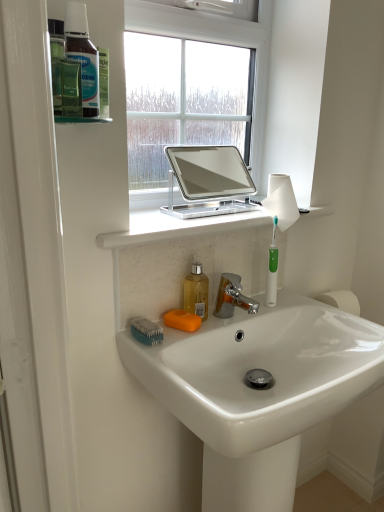
Question: Is white glossy sink at center not inside green plastic toothbrush at right?

Choices:
 (A) yes
 (B) no

Answer: (A)

Question: Is white glossy sink at center bigger than green plastic toothbrush at right?

Choices:
 (A) no
 (B) yes

Answer: (B)

Question: Is the depth of white glossy sink at center less than that of green plastic toothbrush at right?

Choices:
 (A) no
 (B) yes

Answer: (B)

Question: Is white glossy sink at center further to camera compared to green plastic toothbrush at right?

Choices:
 (A) yes
 (B) no

Answer: (B)

Question: Is green plastic toothbrush at right inside white glossy sink at center?

Choices:
 (A) yes
 (B) no

Answer: (B)

Question: Looking at their shapes, would you say green plastic toothbrush at right is wider or thinner than translucent plastic bottles at upper left?

Choices:
 (A) thin
 (B) wide

Answer: (A)

Question: From a real-world perspective, is green plastic toothbrush at right positioned above or below translucent plastic bottles at upper left?

Choices:
 (A) above
 (B) below

Answer: (B)

Question: Is green plastic toothbrush at right in front of or behind translucent plastic bottles at upper left in the image?

Choices:
 (A) behind
 (B) front

Answer: (A)

Question: In terms of size, does green plastic toothbrush at right appear bigger or smaller than translucent plastic bottles at upper left?

Choices:
 (A) big
 (B) small

Answer: (B)

Question: From the image's perspective, is orange matte soap at sink above or below translucent yellow liquid at sink?

Choices:
 (A) below
 (B) above

Answer: (A)

Question: Would you say orange matte soap at sink is to the left or to the right of translucent yellow liquid at sink in the picture?

Choices:
 (A) right
 (B) left

Answer: (B)

Question: Which is correct: orange matte soap at sink is inside translucent yellow liquid at sink, or outside of it?

Choices:
 (A) inside
 (B) outside

Answer: (B)

Question: Considering the positions of orange matte soap at sink and translucent yellow liquid at sink in the image, is orange matte soap at sink wider or thinner than translucent yellow liquid at sink?

Choices:
 (A) thin
 (B) wide

Answer: (B)

Question: Looking at their shapes, would you say orange matte soap at sink is wider or thinner than white marble countertop at upper center?

Choices:
 (A) thin
 (B) wide

Answer: (A)

Question: Considering their positions, is orange matte soap at sink located in front of or behind white marble countertop at upper center?

Choices:
 (A) behind
 (B) front

Answer: (A)